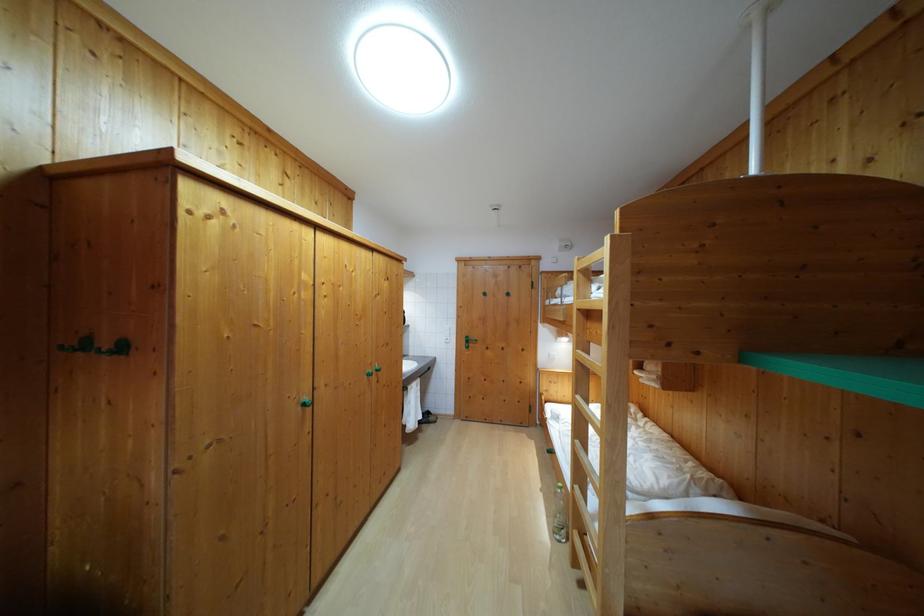
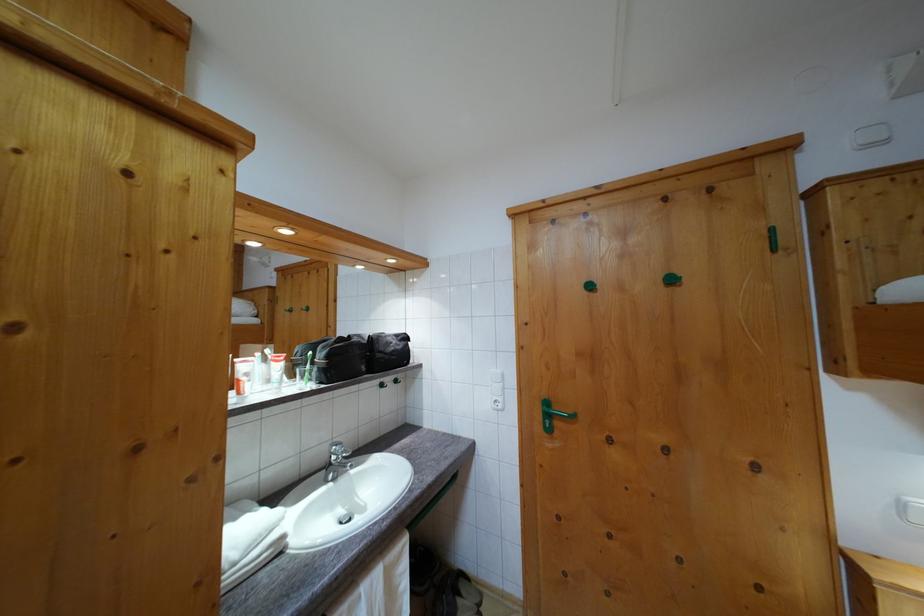
Where in the second image is the point corresponding to point (512, 302) from the first image?

(675, 286)